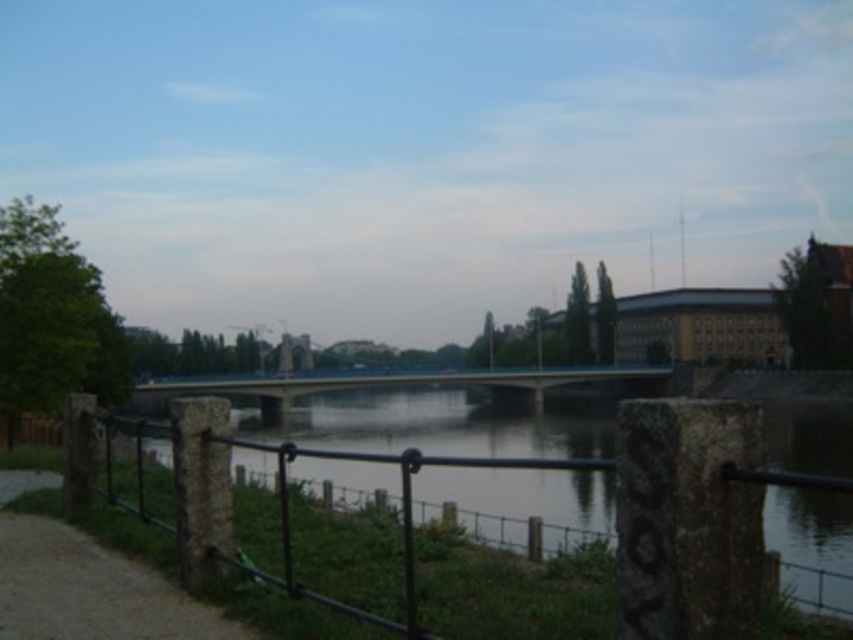
You are standing on the riverside pathway and see two points marked on the image. The first point is at coordinates point (x=625, y=531) and the second is at point (x=53, y=548). Which point is closer to you from your current position?

Point (x=625, y=531) is in front of point (x=53, y=548), so the first point is closer to you.

You are a landscape architect reviewing a design plan for a riverside walkway. The design includes a black metal fence at center and a concrete bridge at center. Based on the provided image, which of these two structures is more suitable to be placed closer to the water edge for safety reasons?

The concrete bridge at center is more suitable to be placed closer to the water edge for safety reasons because it is larger than the black metal fence at center, making it more stable and durable in such an environment.